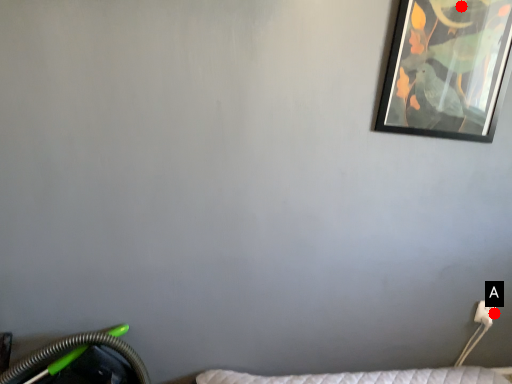
Question: Two points are circled on the image, labeled by A and B beside each circle. Which point appears farthest from the camera in this image?

Choices:
 (A) A is further
 (B) B is further

Answer: (A)